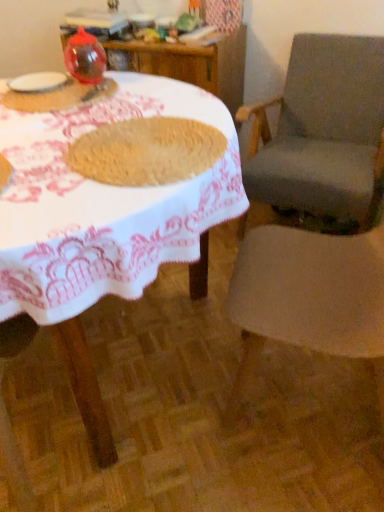
You are a GUI agent. You are given a task and a screenshot of the screen. Output one action in this format:
    pyautogui.click(x=<x>, y=<y>)
    Task: Click on the vacant area in front of translucent plastic cup at upper left, which appears as the first tableware when ordered from the bottom
    The width and height of the screenshot is (384, 512).
    Given the screenshot: What is the action you would take?
    pyautogui.click(x=48, y=127)